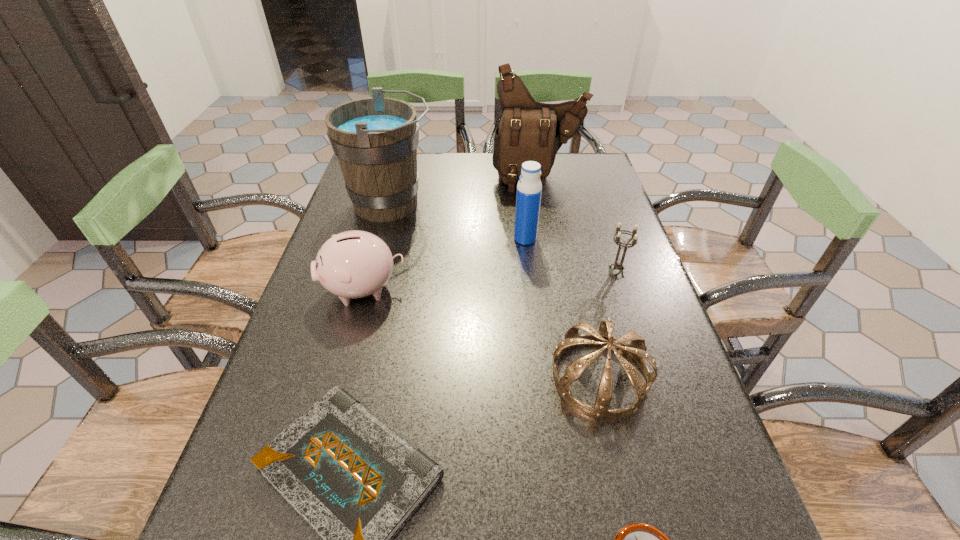
Find the location of a particular element. Image resolution: width=960 pixels, height=540 pixels. object identified as the fifth closest to the tiara is located at coordinates (353, 264).

The image size is (960, 540). Identify the location of the fourth closest object relative to the piggy bank. (636, 349).

At what (x,y) coordinates should I click in order to perform the action: click on vacant position in the image that satisfies the following two spatial constraints: 1. with a handle on the side of the wine bucket; 2. on the left side of the tiara. Please return your answer as a coordinate pair (x, y). Image resolution: width=960 pixels, height=540 pixels. Looking at the image, I should click on coord(346,376).

Identify the location of vacant point that satisfies the following two spatial constraints: 1. with a handle on the side of the wine bucket; 2. on the back side of the third farthest object. This screenshot has width=960, height=540. (382, 239).

At what (x,y) coordinates should I click in order to perform the action: click on blank area in the image that satisfies the following two spatial constraints: 1. on the front-facing side of the shoulder bag; 2. with a handle on the side of the wine bucket. Please return your answer as a coordinate pair (x, y). Looking at the image, I should click on (542, 204).

This screenshot has width=960, height=540. What are the coordinates of `free spot that satisfies the following two spatial constraints: 1. with a handle on the side of the wine bucket; 2. on the left side of the sixth shortest object` in the screenshot? It's located at (382, 239).